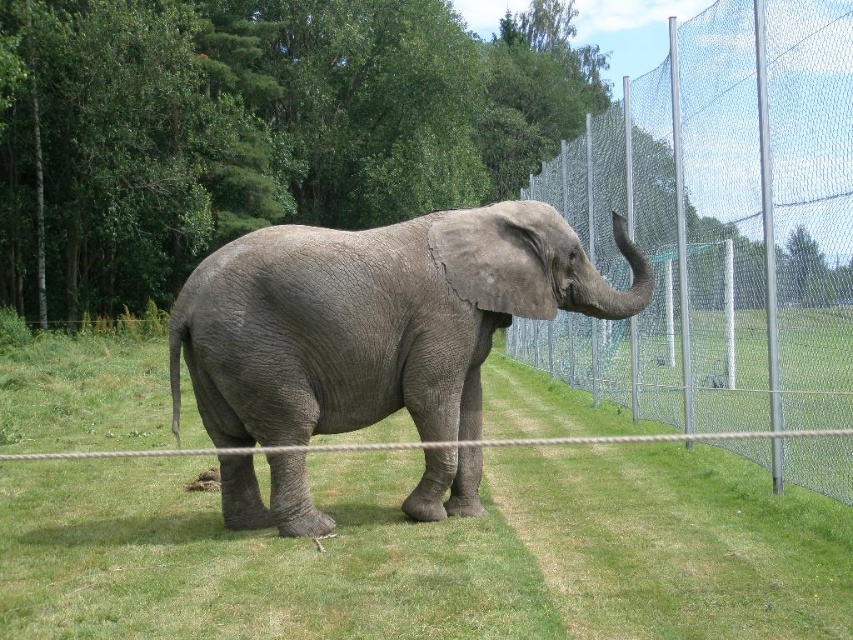
You are standing at the center of the image and want to walk towards the metal mesh fence at right. Which direction should you face to move directly towards it?

You should face towards the right direction to move directly towards the metal mesh fence at right since it is located at the right side of the image.

You are a zookeeper planning to walk between the metal mesh fence at right and the gray textured elephant at center. Can you pass through the space between them without bending sideways?

The metal mesh fence at right has a lesser width compared to the gray textured elephant at center, so the space between them is narrow. You may need to bend sideways to pass through.

You are a zookeeper planning to walk a path between the green grassy at center and the metal mesh fence at right. Which side should you walk on to ensure you stay within the enclosure?

The green grassy at center is wider than the metal mesh fence at right, so walking on the side of the green grassy at center ensures you stay within the enclosure as it provides more space.